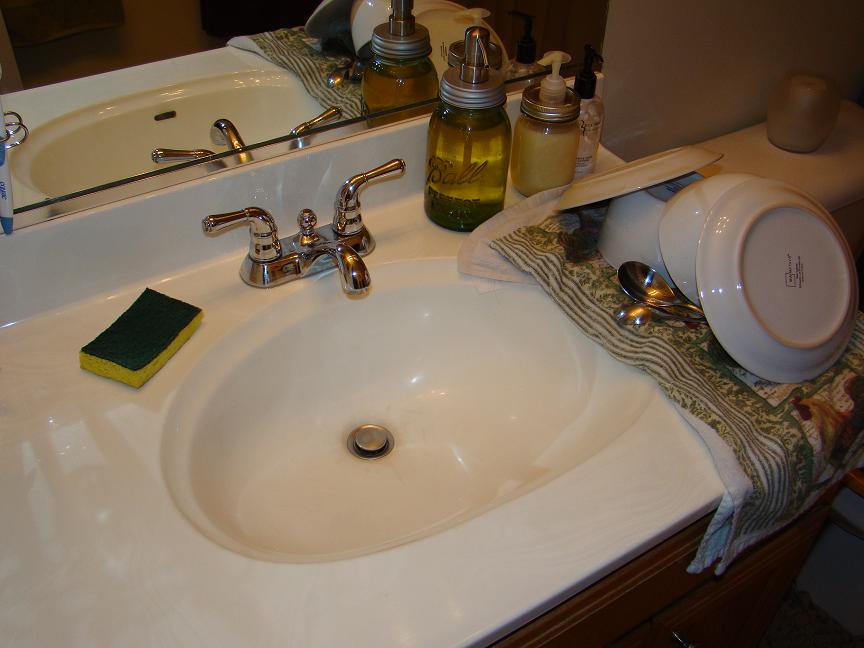
The width and height of the screenshot is (864, 648). In order to click on plate in this screenshot , I will do `click(702, 243)`.